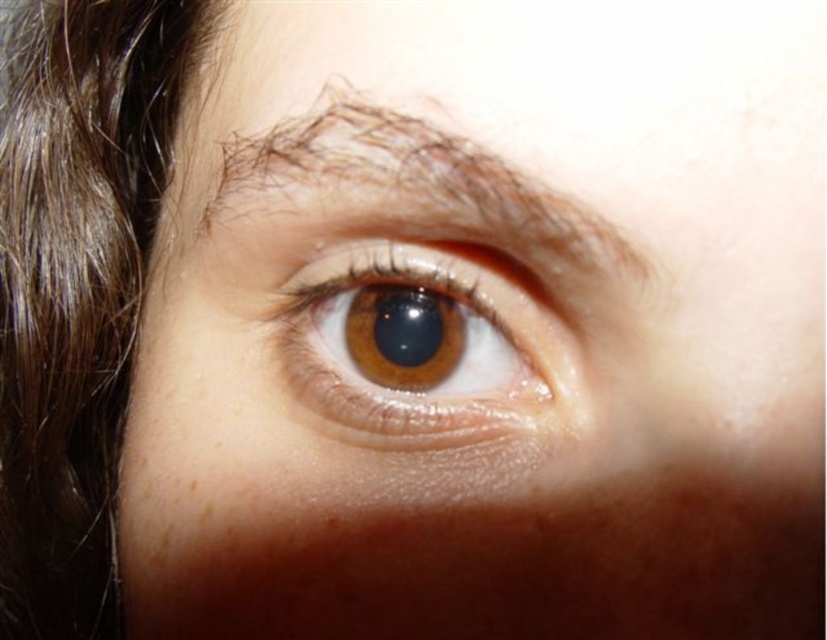
Question: Does brown shiny hair at left lie in front of brown matte eye at center?

Choices:
 (A) no
 (B) yes

Answer: (A)

Question: Does brown matte eye at center lie behind brown hair at upper center?

Choices:
 (A) no
 (B) yes

Answer: (B)

Question: Which point is farther to the camera?

Choices:
 (A) brown hair at upper center
 (B) brown matte eye at center

Answer: (B)

Question: Which point is farther to the camera?

Choices:
 (A) brown matte eye at center
 (B) brown shiny hair at left

Answer: (B)

Question: Among these points, which one is nearest to the camera?

Choices:
 (A) (622, 262)
 (B) (548, 400)

Answer: (A)

Question: Can you confirm if brown matte eye at center is positioned to the right of brown hair at upper center?

Choices:
 (A) yes
 (B) no

Answer: (A)